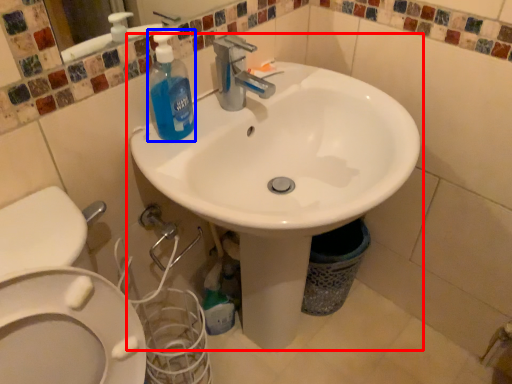
Question: Which object is closer to the camera taking this photo, sink (highlighted by a red box) or cleaning product (highlighted by a blue box)?

Choices:
 (A) sink
 (B) cleaning product

Answer: (A)